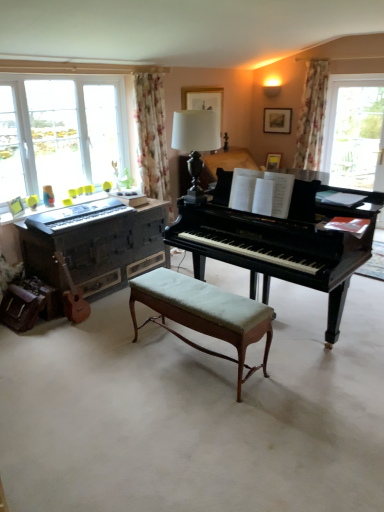
You are a GUI agent. You are given a task and a screenshot of the screen. Output one action in this format:
    pyautogui.click(x=<x>, y=<y>)
    Task: Click on the free space in front of light green upholstered bench at center
    
    Given the screenshot: What is the action you would take?
    pyautogui.click(x=193, y=425)